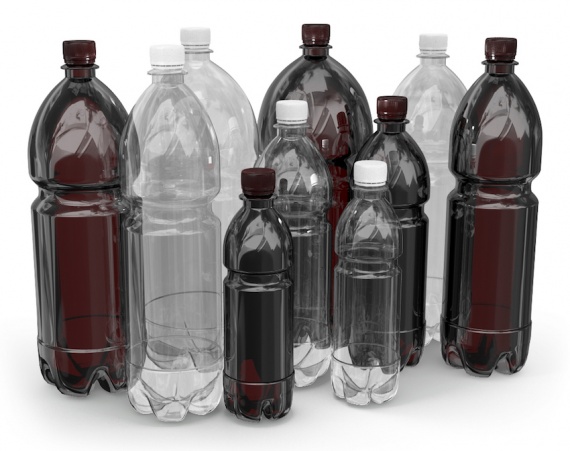
Where is `bottles`? The height and width of the screenshot is (451, 570). bottles is located at coordinates (96, 133), (166, 137), (231, 80), (259, 246), (299, 180), (356, 231), (393, 179), (327, 89), (424, 93), (528, 120).